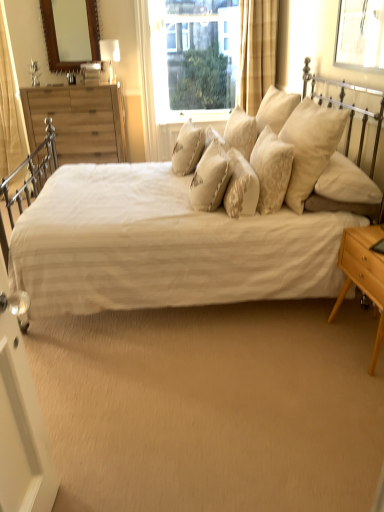
You are a GUI agent. You are given a task and a screenshot of the screen. Output one action in this format:
    pyautogui.click(x=<x>, y=<y>)
    Task: Click on the unoccupied space behind light wood/texture nightstand at lower right
    This screenshot has height=512, width=384.
    Given the screenshot: What is the action you would take?
    pyautogui.click(x=331, y=308)